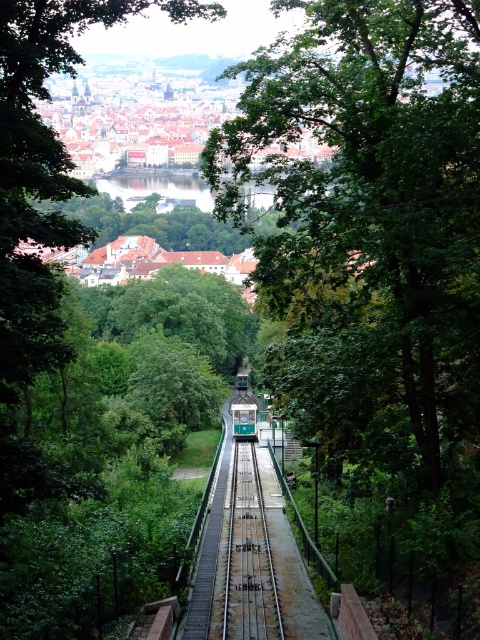
Which is behind, point (0, 362) or point (247, 410)?

Positioned behind is point (247, 410).

Image resolution: width=480 pixels, height=640 pixels. What do you see at coordinates (44, 168) in the screenshot? I see `green leafy tree at upper center` at bounding box center [44, 168].

Where is `green leafy tree at upper center`? Image resolution: width=480 pixels, height=640 pixels. green leafy tree at upper center is located at coordinates (44, 168).

Does point (454, 289) come closer to viewer compared to point (269, 589)?

That is True.

Who is taller, green leafy tree at center or green metallic train track at center?

green leafy tree at center

Image resolution: width=480 pixels, height=640 pixels. What do you see at coordinates (368, 221) in the screenshot?
I see `green leafy tree at center` at bounding box center [368, 221].

I want to click on green leafy tree at center, so pyautogui.click(x=368, y=221).

Is point (72, 1) more distant than point (252, 532)?

No, (72, 1) is closer to viewer.

Does green leafy tree at upper center appear under green metallic train track at center?

No, green leafy tree at upper center is not below green metallic train track at center.

Is point (54, 156) more distant than point (271, 556)?

No, (54, 156) is in front of (271, 556).

You are a GUI agent. You are given a task and a screenshot of the screen. Output one action in this format:
    pyautogui.click(x=<x>, y=<y>)
    Task: Click on the green leafy tree at upper center
    
    Given the screenshot: What is the action you would take?
    pyautogui.click(x=44, y=168)